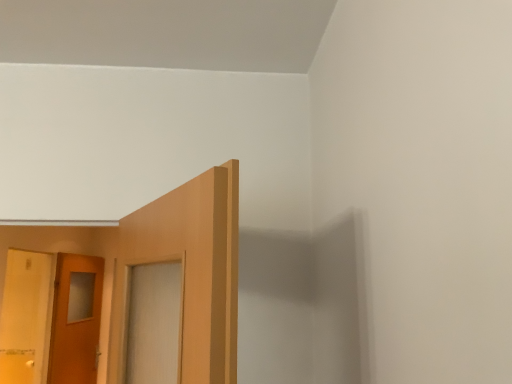
Question: Considering the relative sizes of matte wooden door at left, the 2th door in the back-to-front sequence, and matte wooden door at left, which is counted as the second door, starting from the front, in the image provided, is matte wooden door at left, the 2th door in the back-to-front sequence, thinner than matte wooden door at left, which is counted as the second door, starting from the front,?

Choices:
 (A) yes
 (B) no

Answer: (B)

Question: Could matte wooden door at left, the 1th door from the back, be considered to be inside matte wooden door at left, positioned as the 1th door in front-to-back order?

Choices:
 (A) no
 (B) yes

Answer: (A)

Question: Considering the relative positions of matte wooden door at left, positioned as the 1th door in front-to-back order, and matte wooden door at left, the 1th door from the back, in the image provided, is matte wooden door at left, positioned as the 1th door in front-to-back order, to the left of matte wooden door at left, the 1th door from the back, from the viewer's perspective?

Choices:
 (A) no
 (B) yes

Answer: (B)

Question: From a real-world perspective, is matte wooden door at left, the 2th door in the back-to-front sequence, located higher than matte wooden door at left, the 1th door from the back?

Choices:
 (A) no
 (B) yes

Answer: (B)

Question: Can you confirm if matte wooden door at left, positioned as the 1th door in front-to-back order, is taller than matte wooden door at left, the 1th door from the back?

Choices:
 (A) yes
 (B) no

Answer: (B)

Question: Does matte wooden door at left, the 2th door in the back-to-front sequence, turn towards matte wooden door at left, the 1th door from the back?

Choices:
 (A) no
 (B) yes

Answer: (A)

Question: Is matte wooden door at left, which is counted as the second door, starting from the front, at the left side of matte wooden door at left, positioned as the 1th door in front-to-back order?

Choices:
 (A) no
 (B) yes

Answer: (A)

Question: Would you consider matte wooden door at left, which is counted as the second door, starting from the front, to be distant from matte wooden door at left, the 2th door in the back-to-front sequence?

Choices:
 (A) yes
 (B) no

Answer: (B)

Question: Is matte wooden door at left, the 1th door from the back, facing away from matte wooden door at left, positioned as the 1th door in front-to-back order?

Choices:
 (A) no
 (B) yes

Answer: (A)

Question: Considering the relative sizes of matte wooden door at left, which is counted as the second door, starting from the front, and matte wooden door at left, positioned as the 1th door in front-to-back order, in the image provided, is matte wooden door at left, which is counted as the second door, starting from the front, wider than matte wooden door at left, positioned as the 1th door in front-to-back order,?

Choices:
 (A) no
 (B) yes

Answer: (A)

Question: Is the position of matte wooden door at left, the 1th door from the back, more distant than that of matte wooden door at left, positioned as the 1th door in front-to-back order?

Choices:
 (A) no
 (B) yes

Answer: (B)

Question: From a real-world perspective, is matte wooden door at left, which is counted as the second door, starting from the front, under matte wooden door at left, the 2th door in the back-to-front sequence?

Choices:
 (A) yes
 (B) no

Answer: (A)

Question: Considering the positions of point (45, 264) and point (99, 271), is point (45, 264) closer or farther from the camera than point (99, 271)?

Choices:
 (A) closer
 (B) farther

Answer: (B)